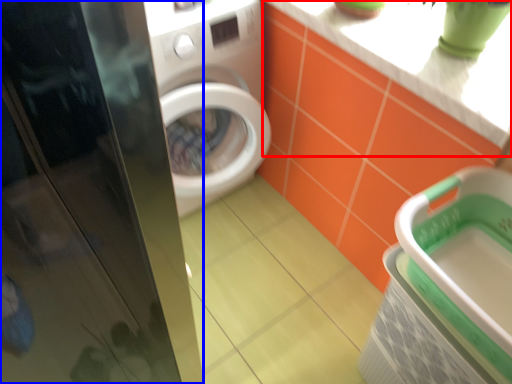
Question: Which object is further to the camera taking this photo, counter top (highlighted by a red box) or screen door (highlighted by a blue box)?

Choices:
 (A) counter top
 (B) screen door

Answer: (A)